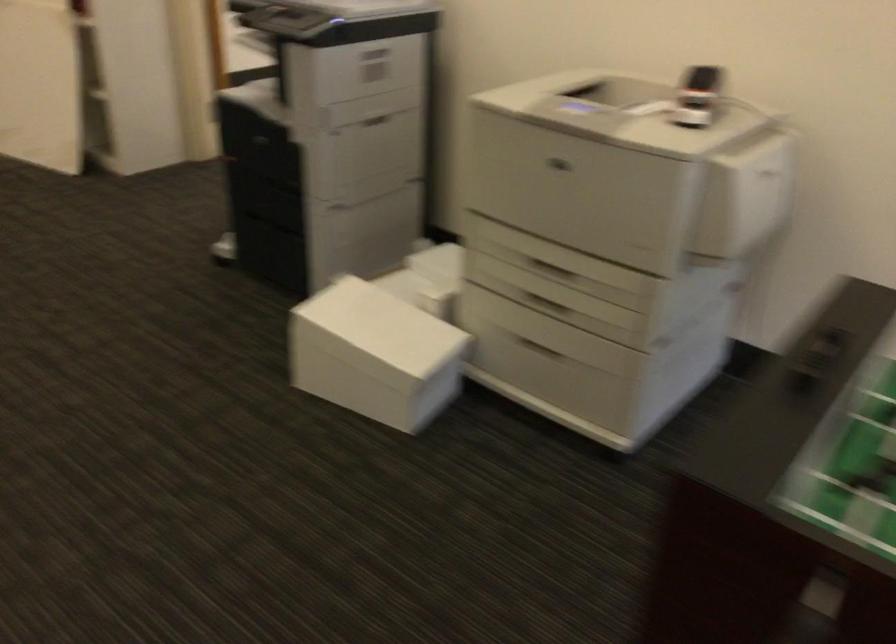
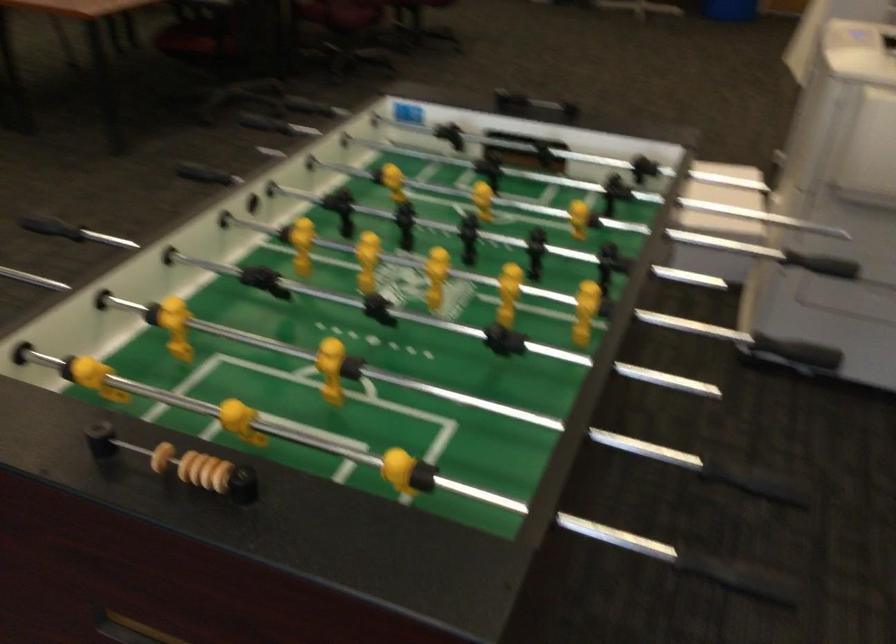
Question: I am providing you with two images of the same scene from different viewpoints. Which of the following objects are not visible in image2?

Choices:
 (A) black rod handle
 (B) printer drawer handle
 (C) wooden scoring bead
 (D) white toy helicopter

Answer: (B)